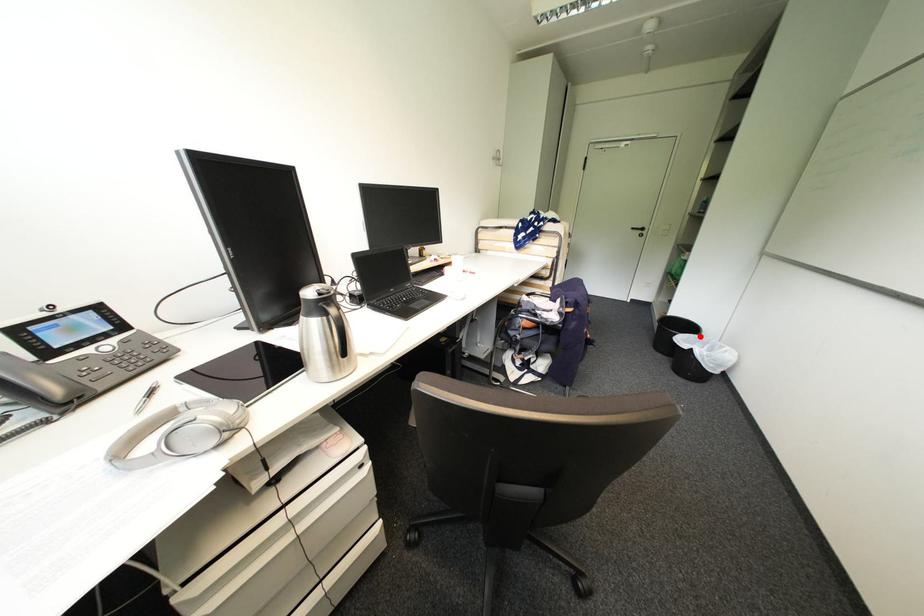
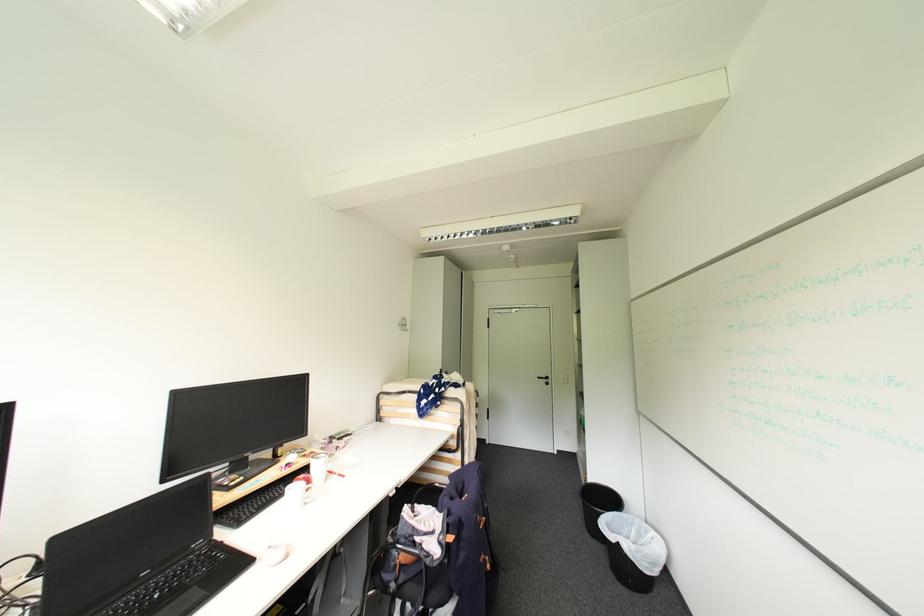
The point at the highlighted location is marked in the first image. Where is the corresponding point in the second image?

(624, 514)